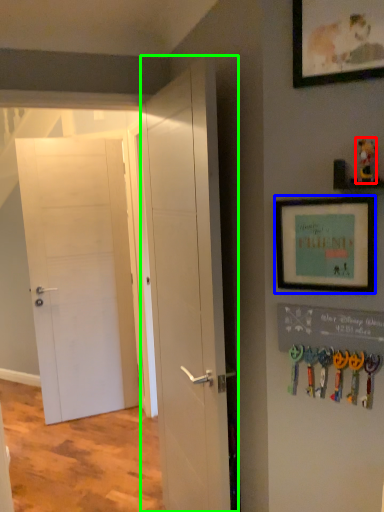
Question: Which is nearer to the toy (highlighted by a red box)? picture frame (highlighted by a blue box) or door (highlighted by a green box).

Choices:
 (A) picture frame
 (B) door

Answer: (A)